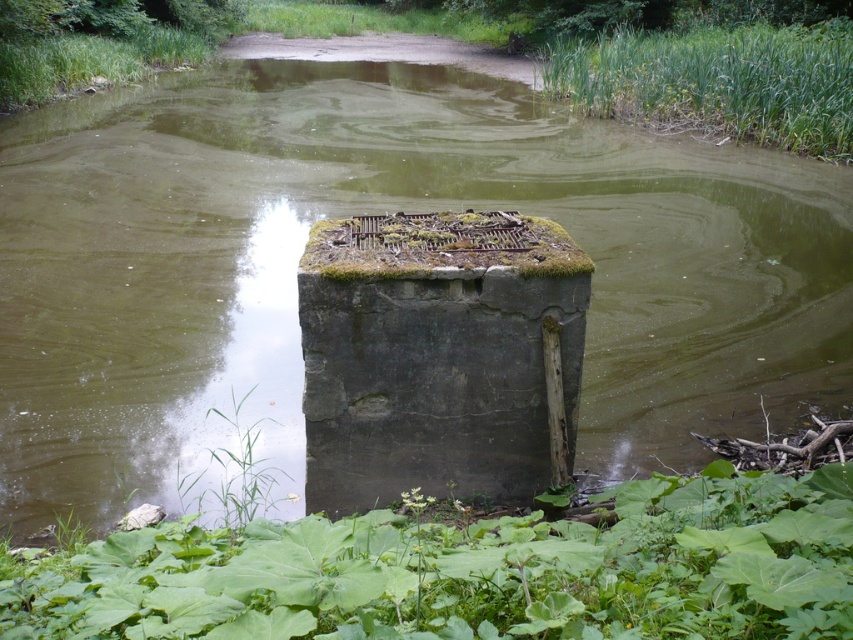
You are standing at the edge of the water and want to reach the green grass at upper left without getting wet. The green leafy plant at lower center is in your path. Can you walk around it? Explain your reasoning based on the distance between them.

The green leafy plant at lower center is 25.56 meters away from the green grass at upper left. Since the distance is quite large, you can easily walk around the green leafy plant at lower center to reach the green grass at upper left without getting wet.

You are standing at the edge of the water and see the green leafy plant at lower center and the dark gray concrete block at center. Which object is closer to you?

The green leafy plant at lower center is closer to you since it is in front of the dark gray concrete block at center.

You are standing near the water and want to pick up the green leafy plant at lower center and the green grass at upper left. Which one can you reach without moving your feet?

The green leafy plant at lower center is closer to the viewer than the green grass at upper left, so you can reach the green leafy plant at lower center without moving your feet.